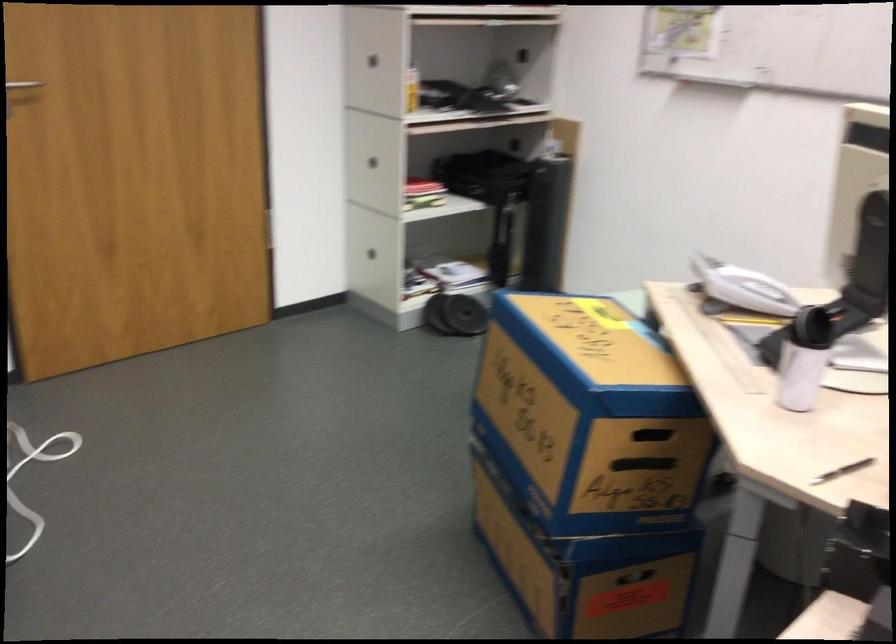
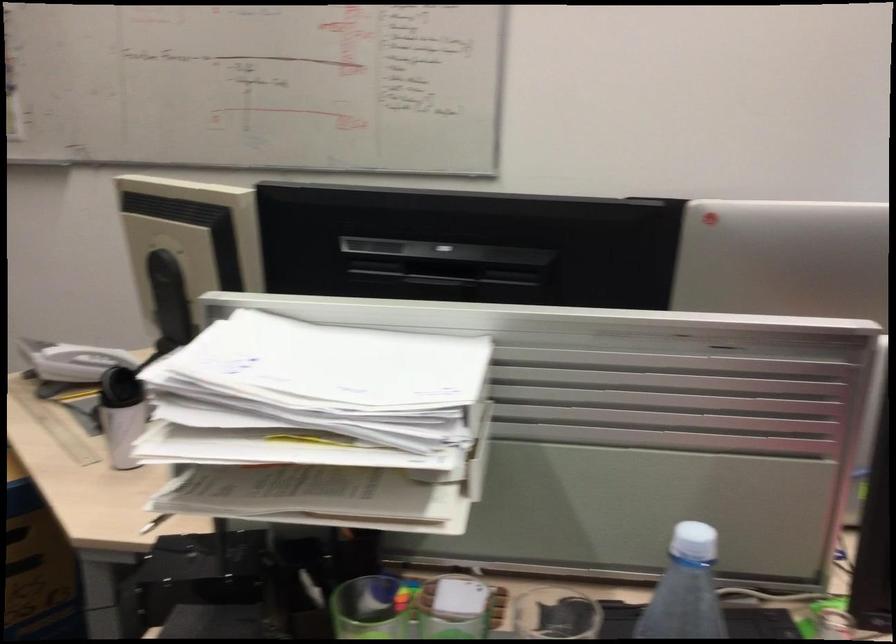
Question: The camera is either moving clockwise (left) or counter-clockwise (right) around the object. The first image is from the beginning of the video and the second image is from the end. Is the camera moving left or right when shooting the video?

Choices:
 (A) Left
 (B) Right

Answer: (A)